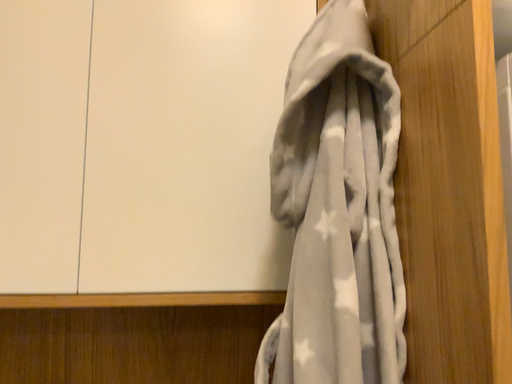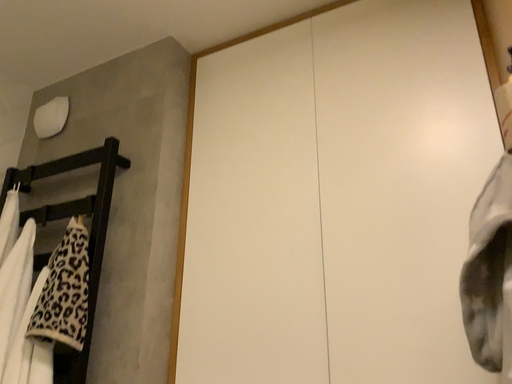
Question: Which way did the camera rotate in the video?

Choices:
 (A) rotated right
 (B) rotated left

Answer: (B)